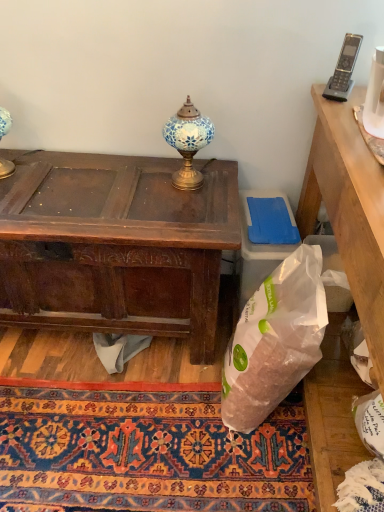
Where is `free space in front of translucent white plastic bag at lower right`? free space in front of translucent white plastic bag at lower right is located at coordinates (243, 470).